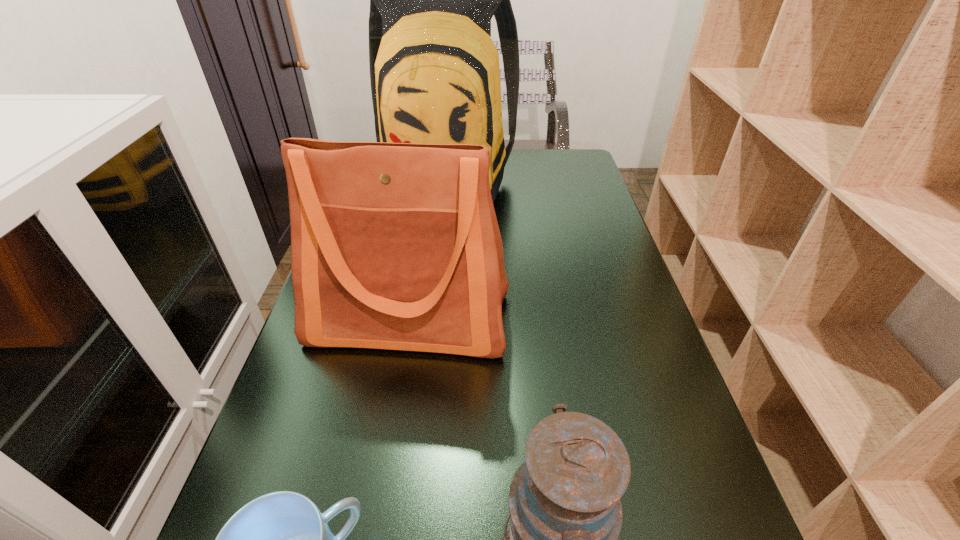
In the image, there is a desktop. Identify the location of vacant space at the right edge. (644, 419).

Locate which object is the third closest to the second shortest object. Please provide its 2D coordinates. Your answer should be formatted as a tuple, i.e. [(x, y)], where the tuple contains the x and y coordinates of a point satisfying the conditions above.

[(434, 69)]

Choose which object is the second nearest neighbor to the tallest object. Please provide its 2D coordinates. Your answer should be formatted as a tuple, i.e. [(x, y)], where the tuple contains the x and y coordinates of a point satisfying the conditions above.

[(565, 513)]